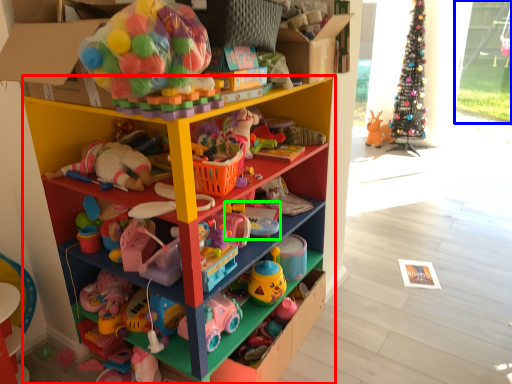
Question: Which is farther away from shelf (highlighted by a red box)? glass door (highlighted by a blue box) or toy (highlighted by a green box)?

Choices:
 (A) glass door
 (B) toy

Answer: (A)